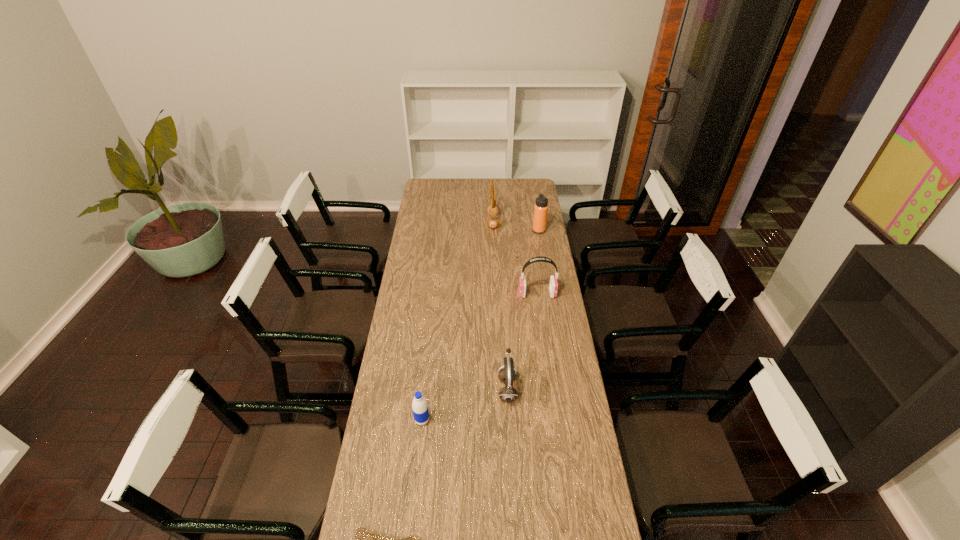
The image size is (960, 540). I want to click on vacant region located on the back of the thermos bottle, so click(x=538, y=221).

Locate an element on the screen. vacant space situated 0.160m on the outer surface of the rightmost earphone is located at coordinates (485, 294).

Image resolution: width=960 pixels, height=540 pixels. What are the coordinates of `vacant space located 0.320m on the outer surface of the rightmost earphone` in the screenshot? It's located at (451, 294).

Locate an element on the screen. This screenshot has height=540, width=960. vacant position located on the outer surface of the rightmost earphone is located at coordinates (447, 294).

You are a GUI agent. You are given a task and a screenshot of the screen. Output one action in this format:
    pyautogui.click(x=<x>, y=<y>)
    Task: Click on the vacant space situated on the ear pads of the nearest earphone
    
    Given the screenshot: What is the action you would take?
    pyautogui.click(x=480, y=389)

Locate an element on the screen. blank space located 0.300m on the ear pads of the nearest earphone is located at coordinates (420, 389).

Locate an element on the screen. vacant space located 0.190m on the ear pads of the nearest earphone is located at coordinates pyautogui.click(x=448, y=389).

Identify the location of vacant space situated 0.380m on the right of the second shortest object. (534, 420).

Locate an element on the screen. This screenshot has height=540, width=960. object that is at the left edge is located at coordinates (419, 405).

Where is `thermos bottle that is at the right edge`? The height and width of the screenshot is (540, 960). thermos bottle that is at the right edge is located at coordinates (541, 207).